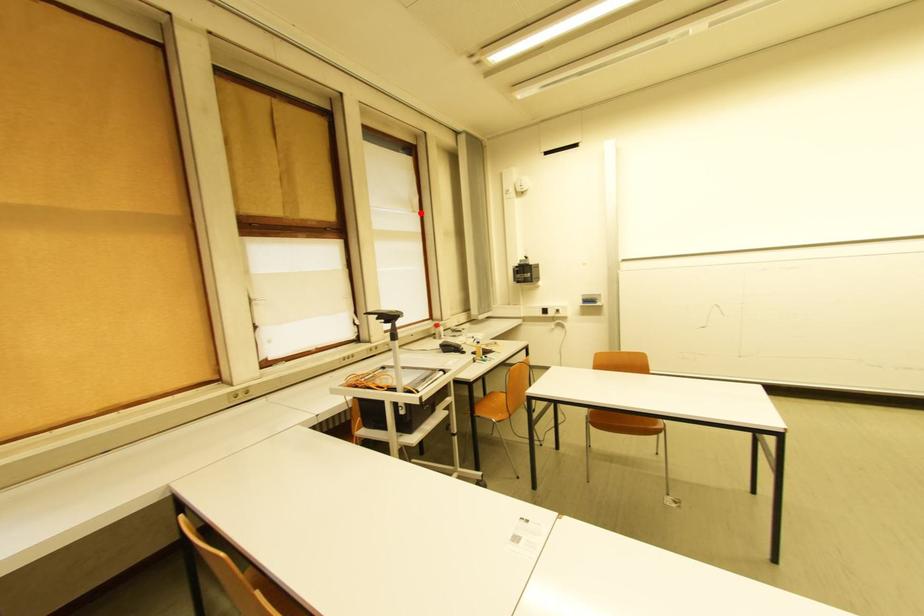
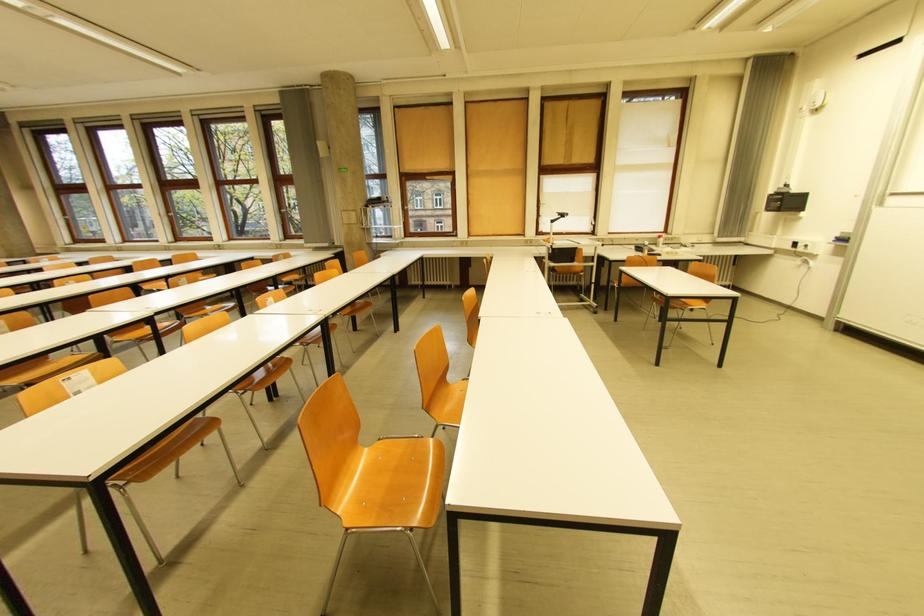
The point at the highlighted location is marked in the first image. Where is the corresponding point in the second image?

(676, 148)